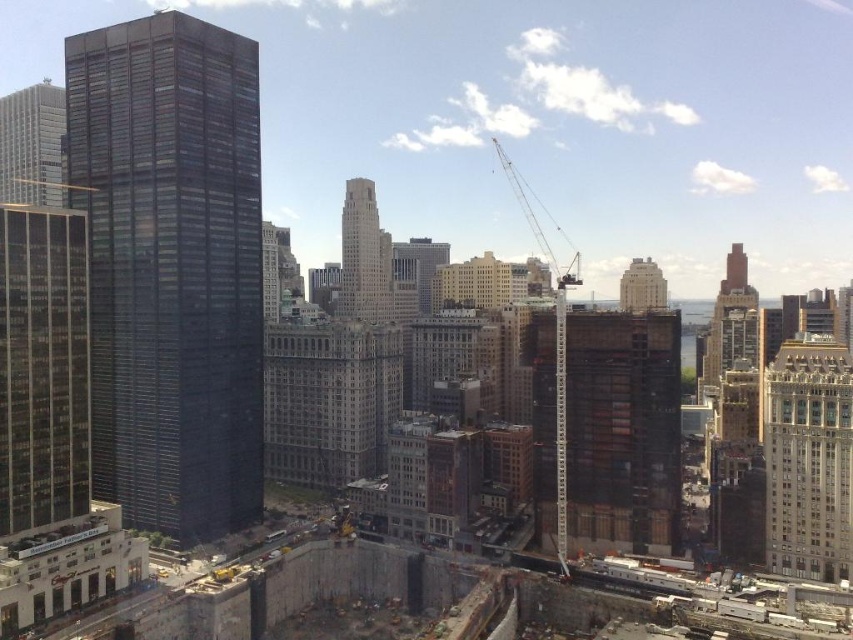
Is gold textured building at right bigger than dark glass skyscraper at upper left?

No, gold textured building at right is not bigger than dark glass skyscraper at upper left.

Is point (827, 381) farther from viewer compared to point (44, 115)?

No.

The height and width of the screenshot is (640, 853). Find the location of `gold textured building at right`. gold textured building at right is located at coordinates (808, 460).

Who is shorter, dark glass skyscraper at upper left or light beige stone skyscraper at center?

Standing shorter between the two is dark glass skyscraper at upper left.

Does point (45, 125) come closer to viewer compared to point (363, 260)?

Yes, it is in front of point (363, 260).

Identify the location of dark glass skyscraper at upper left. (32, 145).

Where is `dark glass skyscraper at left`? Image resolution: width=853 pixels, height=640 pixels. dark glass skyscraper at left is located at coordinates (171, 268).

In the scene shown: Who is positioned more to the left, dark glass skyscraper at left or dark glass skyscraper at upper left?

Positioned to the left is dark glass skyscraper at upper left.

What do you see at coordinates (171, 268) in the screenshot? I see `dark glass skyscraper at left` at bounding box center [171, 268].

This screenshot has width=853, height=640. In order to click on dark glass skyscraper at left in this screenshot , I will do `click(171, 268)`.